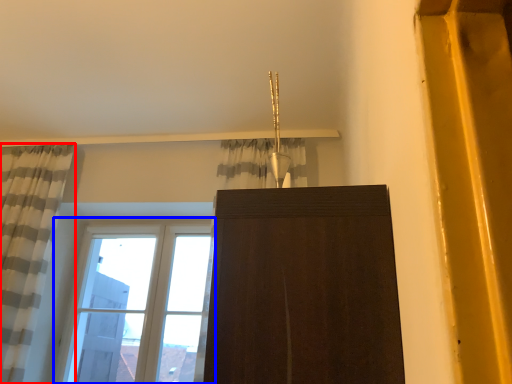
Question: Among these objects, which one is farthest to the camera, curtain (highlighted by a red box) or window (highlighted by a blue box)?

Choices:
 (A) curtain
 (B) window

Answer: (B)